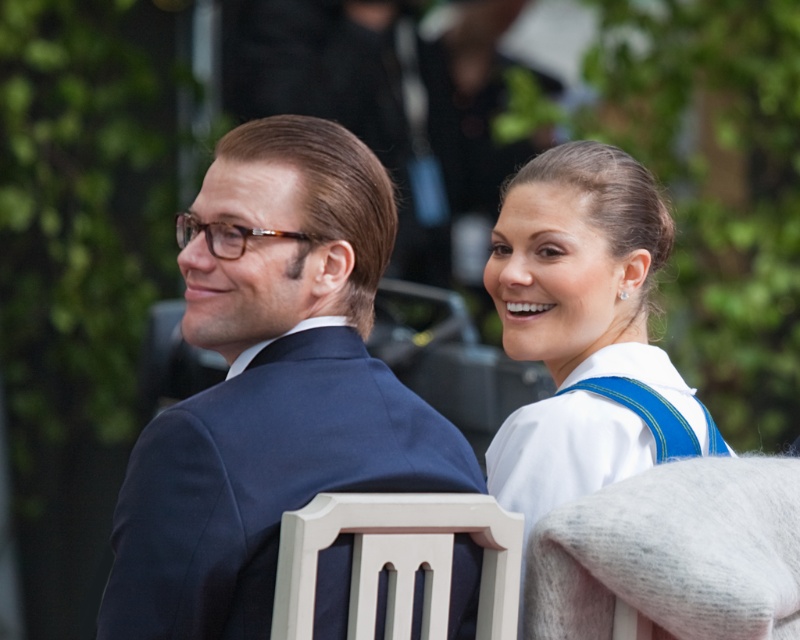
You are an event planner trying to arrange a photo shoot. The scene has two people sitting on chairs. The person on the left is wearing a dark blue suit jacket over a white shirt, and the person on the right is wearing a white fabric dress at upper right. Based on their positions, can you determine which person is seated closer to the camera?

The white fabric dress at upper right is located at point (586, 330) in 2D space, which suggests it is positioned higher up and to the right within the frame. However, without knowing the exact positions of both individuals relative to the camera axis, it is impossible to definitively determine which person is closer based solely on their 2D coordinates. Additional information about depth or perspective would be needed to accurately assess their proximity to the camera.

In the scene shown: You are organizing a photoshoot and need to ensure that the white fabric dress at upper right and the white painted wood chair at center are visible in the frame. Given that the dress is larger, which object should you prioritize positioning first to ensure both fit in the photo?

The white fabric dress at upper right is larger than the white painted wood chair at center, so you should prioritize positioning the white fabric dress at upper right first to ensure both fit in the photo.

You are a photographer setting up for an event. You need to position a spotlight that can only illuminate objects to the right of the navy blue suit at left. Will the white fabric dress at upper right be illuminated by this spotlight?

The navy blue suit at left is to the left of white fabric dress at upper right, so the spotlight positioned to illuminate objects to the right of the navy blue suit at left will indeed illuminate the white fabric dress at upper right.